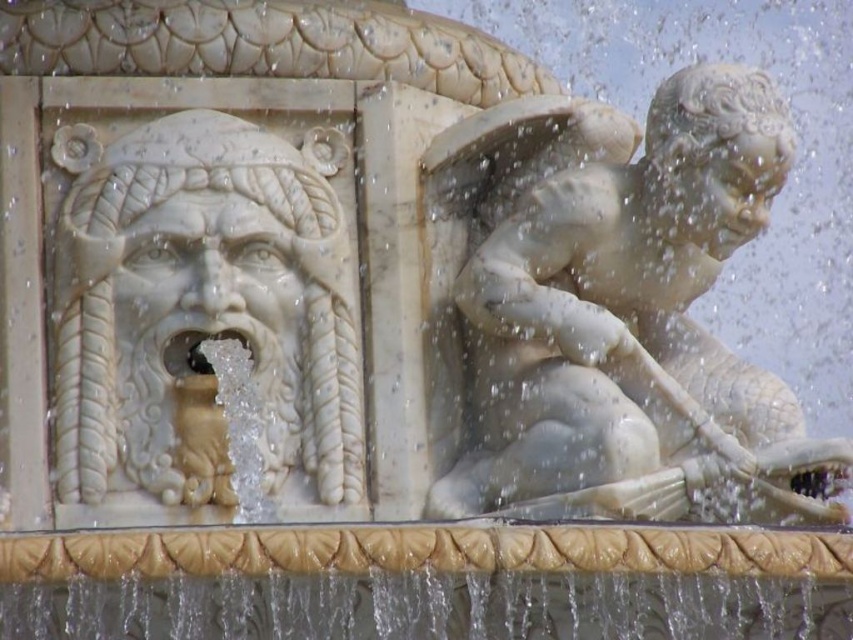
You are standing in front of the fountain and want to touch both the white marble statue at right and the white marble face at left. Which one can you reach first without moving your position?

You can reach the white marble statue at right first because it is closer to you than the white marble face at left.

Consider the image. You are standing in front of the fountain and want to take a photo of the white marble statue at right. Considering the statue is 87.34 meters away from you, what should you do to ensure it is clearly visible in your photo?

The white marble statue at right is 87.34 meters away from the camera, so to ensure it is clearly visible in your photo, you should use a telephoto lens to zoom in on the statue.